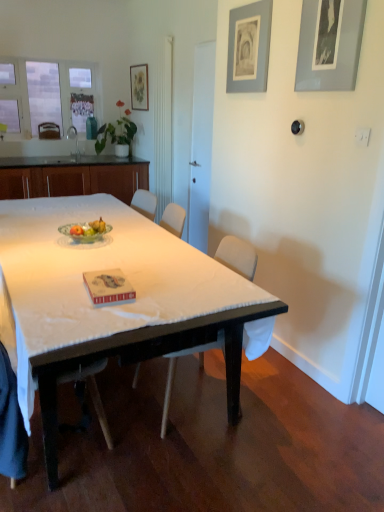
Identify the location of vacant area located to the right-hand side of green glass bowl at center. (125, 242).